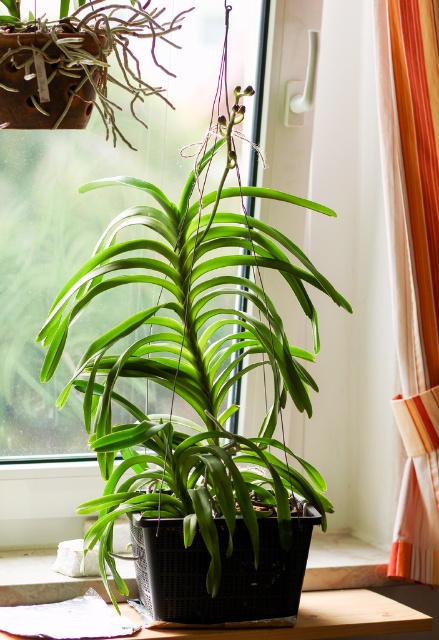
Does green matte plant at center appear on the left side of orange striped fabric at right?

Correct, you'll find green matte plant at center to the left of orange striped fabric at right.

Is point (93, 186) farther from camera compared to point (382, 134)?

No.

At what (x,y) coordinates should I click in order to perform the action: click on green matte plant at center. Please return your answer as a coordinate pair (x, y). The width and height of the screenshot is (439, 640). Looking at the image, I should click on tap(191, 362).

Does green matte plant at center appear under transparent glass window at center?

Indeed, green matte plant at center is positioned under transparent glass window at center.

Which is in front, point (267, 362) or point (14, 368)?

Positioned in front is point (267, 362).

Is point (290, 477) positioned behind point (240, 156)?

No, (290, 477) is in front of (240, 156).

Identify the location of green matte plant at center. (191, 362).

Does transparent glass window at center have a greater width compared to orange striped fabric at right?

Indeed, transparent glass window at center has a greater width compared to orange striped fabric at right.

Does transparent glass window at center have a larger size compared to orange striped fabric at right?

Yes.

Between point (136, 307) and point (438, 291), which one is positioned in front?

Point (438, 291) is in front.

At what (x,y) coordinates should I click in order to perform the action: click on transparent glass window at center. Please return your answer as a coordinate pair (x, y). The width and height of the screenshot is (439, 640). Looking at the image, I should click on (85, 230).